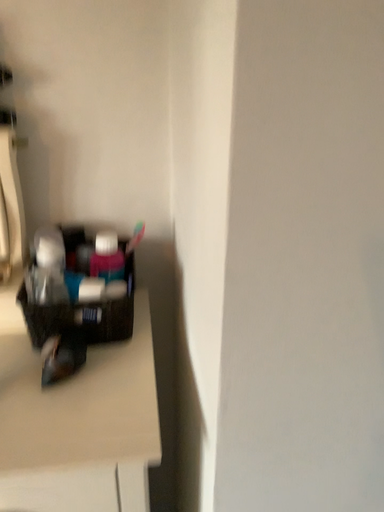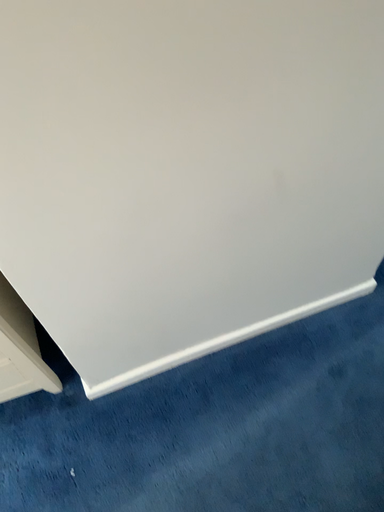
Question: Which way did the camera rotate in the video?

Choices:
 (A) rotated upward
 (B) rotated downward

Answer: (B)